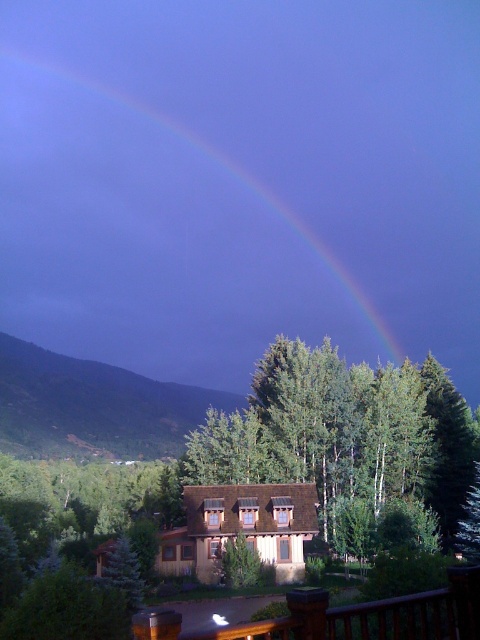
You are an astronomer analyzing the image. The rainbow at upper center is located at coordinates point 0.380, 0.319. If you want to locate it precisely, which direction should you look from the center of the image?

The rainbow at upper center is located at point (153,243). Since the coordinates are given as x,y, the x value 0.380 is to the left of center and the y value 0.319 is below center, so you should look slightly to the left and down from the center of the image to locate the rainbow at upper center.

You are standing at the point with coordinates point (x=441, y=528) and want to see the point with coordinates point (x=168, y=326). Can you see it without moving?

Point (x=168, y=326) is behind point (x=441, y=528), so you cannot see it without moving.

You are standing in the serene landscape scene and want to locate the point at coordinates point (153, 243). According to the image description, where exactly is this point located?

The point (153, 243) is located on the rainbow at upper center.